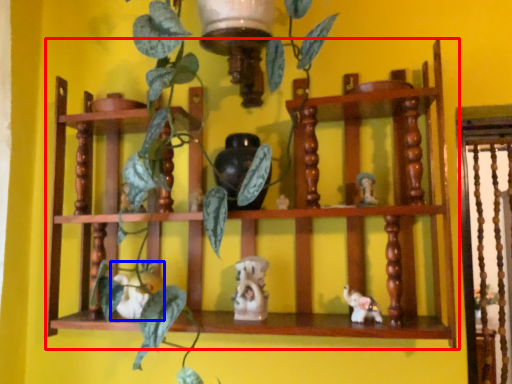
Question: Which object appears farthest to the camera in this image, shelf (highlighted by a red box) or toy (highlighted by a blue box)?

Choices:
 (A) shelf
 (B) toy

Answer: (B)